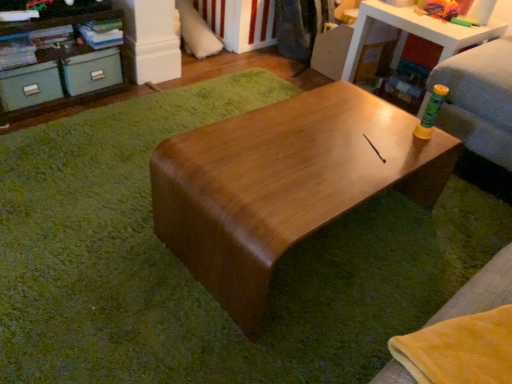
At what (x,y) coordinates should I click in order to perform the action: click on empty space that is ontop of shiny brown table at center, the first table from the front (from a real-world perspective). Please return your answer as a coordinate pair (x, y). Image resolution: width=512 pixels, height=384 pixels. Looking at the image, I should click on (313, 151).